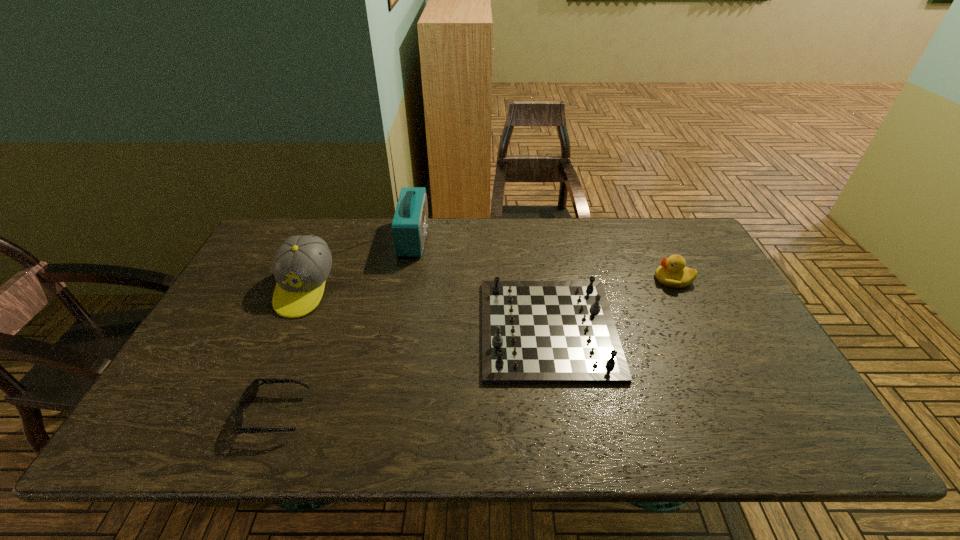
Identify the location of free location located 0.260m on the front-facing side of the baseball cap. (255, 402).

I want to click on vacant space located at the face of the rightmost object, so click(615, 279).

Locate an element on the screen. This screenshot has width=960, height=540. free location located 0.400m at the face of the rightmost object is located at coordinates (522, 279).

The height and width of the screenshot is (540, 960). I want to click on free space located 0.280m at the face of the rightmost object, so click(562, 279).

This screenshot has height=540, width=960. Identify the location of free space located 0.360m on the board of the fourth tallest object. (347, 329).

Where is `vacant position located 0.300m on the board of the fourth tallest object`? vacant position located 0.300m on the board of the fourth tallest object is located at coordinates (370, 329).

I want to click on free location located 0.070m on the board of the fourth tallest object, so click(456, 329).

Where is `vacant space situated 0.340m on the front-facing side of the sunglasses`? This screenshot has width=960, height=540. vacant space situated 0.340m on the front-facing side of the sunglasses is located at coordinates (459, 413).

Identify the location of object positioned at the far edge. (410, 222).

Identify the location of object that is at the near edge. (250, 393).